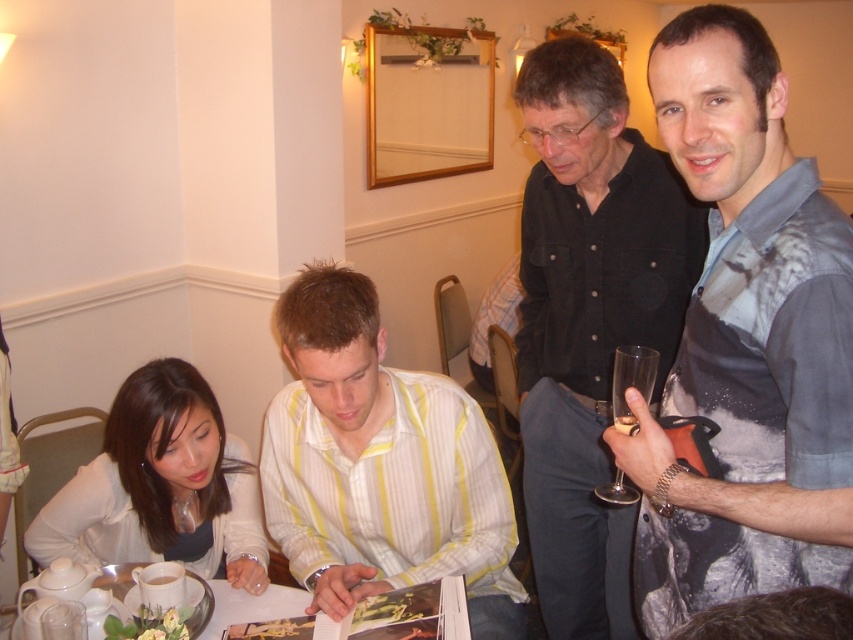
Question: Among these points, which one is nearest to the camera?

Choices:
 (A) (18, 621)
 (B) (740, 364)
 (C) (567, 548)

Answer: (B)

Question: Which of the following is the closest to the observer?

Choices:
 (A) (635, 532)
 (B) (544, 196)

Answer: (A)

Question: Is yellow striped shirt at center positioned before white ceramic table at lower center?

Choices:
 (A) no
 (B) yes

Answer: (A)

Question: Which of the following is the farthest from the observer?

Choices:
 (A) printed cotton shirt at center
 (B) black shirt at upper right

Answer: (B)

Question: Can you confirm if printed cotton shirt at center is bigger than white ceramic table at lower center?

Choices:
 (A) no
 (B) yes

Answer: (B)

Question: Does printed cotton shirt at center appear under yellow striped shirt at center?

Choices:
 (A) yes
 (B) no

Answer: (B)